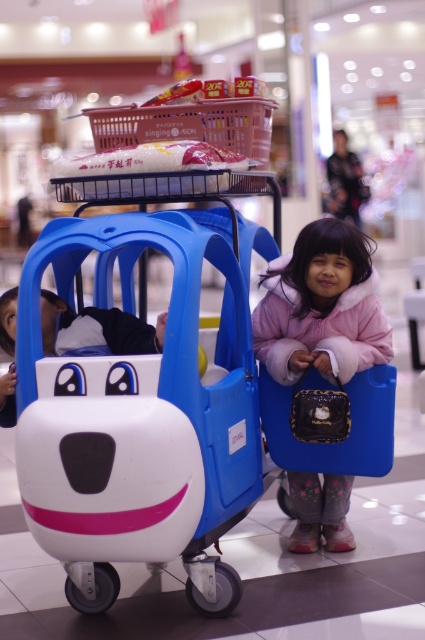
You are a parent trying to decide whether to put your child into the matte plastic baby carriage at center or let them wear the pink fleece jacket at lower right. Based on their sizes, which one do you think would be more appropriate for a newborn?

The matte plastic baby carriage at center is bigger than the pink fleece jacket at lower right, so the pink fleece jacket at lower right would be more appropriate for a newborn since it is smaller and fits better.

You are a parent trying to push both the matte plastic baby carriage at center and the pink fleece jacket at lower right through a narrow doorway. Which object will you have to maneuver first due to its larger size?

The matte plastic baby carriage at center has a greater width than the pink fleece jacket at lower right, so you should maneuver it first through the narrow doorway.

You are a parent trying to push your baby stroller through the mall. There is a matte plastic baby carriage at center and a pink fleece jacket at lower right in your way. Which object should you move first to clear the path?

The matte plastic baby carriage at center is in front of the pink fleece jacket at lower right, so you should move the matte plastic baby carriage at center first to clear the path.